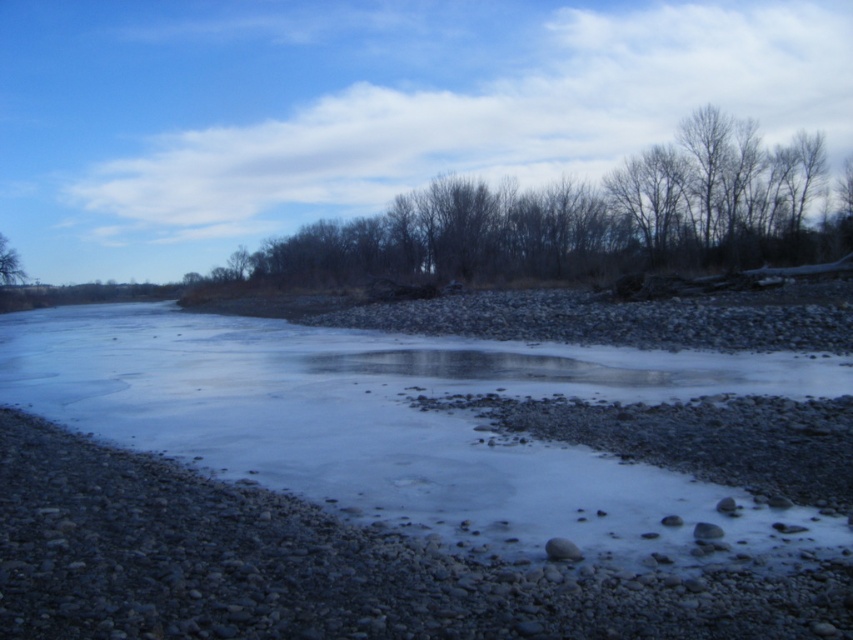
Is bare branches at upper center closer to camera compared to smooth gray rock at center?

No, it is behind smooth gray rock at center.

Is bare branches at upper center thinner than smooth gray rock at center?

No.

Image resolution: width=853 pixels, height=640 pixels. Describe the element at coordinates (581, 220) in the screenshot. I see `bare branches at upper center` at that location.

This screenshot has width=853, height=640. Identify the location of bare branches at upper center. (581, 220).

Which of these two, bare branches at upper center or brown rough tree at left, stands taller?

Standing taller between the two is bare branches at upper center.

This screenshot has height=640, width=853. What do you see at coordinates (581, 220) in the screenshot?
I see `bare branches at upper center` at bounding box center [581, 220].

Is point (529, 193) positioned before point (0, 232)?

Yes, it is in front of point (0, 232).

You are a GUI agent. You are given a task and a screenshot of the screen. Output one action in this format:
    pyautogui.click(x=<x>, y=<y>)
    Task: Click on the bare branches at upper center
    The height and width of the screenshot is (640, 853).
    Given the screenshot: What is the action you would take?
    pyautogui.click(x=581, y=220)

Is bare branches at upper center thinner than smooth gray rock at lower right?

In fact, bare branches at upper center might be wider than smooth gray rock at lower right.

Which is in front, point (706, 179) or point (708, 536)?

Positioned in front is point (708, 536).

Does point (355, 243) come behind point (714, 528)?

Yes.

At what (x,y) coordinates should I click in order to perform the action: click on bare branches at upper center. Please return your answer as a coordinate pair (x, y). Image resolution: width=853 pixels, height=640 pixels. Looking at the image, I should click on (581, 220).